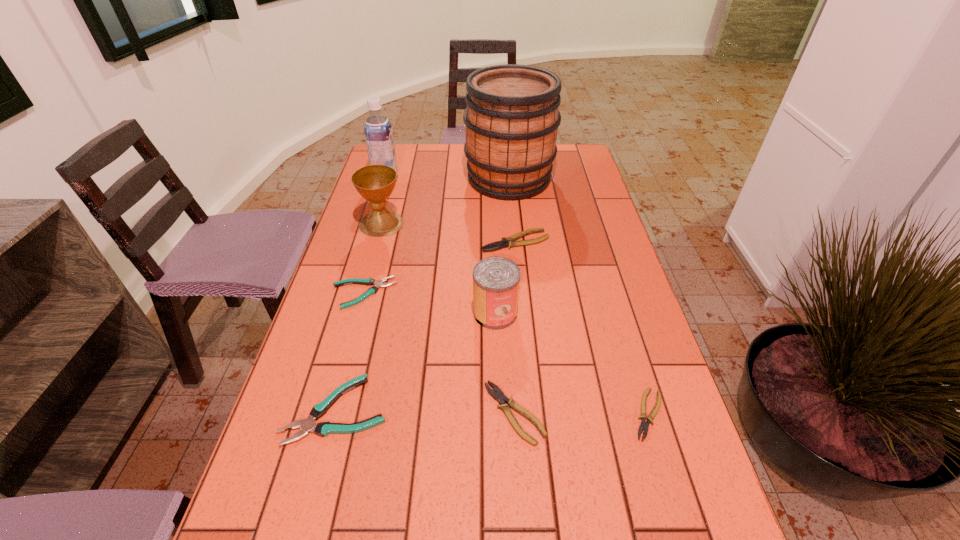
Where is `free spot at the far edge of the desktop`? The width and height of the screenshot is (960, 540). free spot at the far edge of the desktop is located at coordinates (466, 166).

I want to click on vacant space at the left edge of the desktop, so click(x=292, y=443).

In the image, there is a desktop. At what (x,y) coordinates should I click in order to perform the action: click on vacant space at the right edge. Please return your answer as a coordinate pair (x, y). Looking at the image, I should click on (599, 234).

The height and width of the screenshot is (540, 960). Identify the location of vacant space at the far right corner of the desktop. (582, 166).

Where is `free space between the second biggest yellow pliers and the fifth shortest object`? The image size is (960, 540). free space between the second biggest yellow pliers and the fifth shortest object is located at coordinates (515, 327).

Find the location of `empty space that is in between the biggest yellow pliers and the fourth nearest pliers`. empty space that is in between the biggest yellow pliers and the fourth nearest pliers is located at coordinates (440, 267).

Find the location of a particular element. The height and width of the screenshot is (540, 960). free spot between the brown chalice and the nearer teal pliers is located at coordinates (359, 317).

This screenshot has height=540, width=960. I want to click on vacant area that lies between the brown chalice and the tallest pliers, so click(x=448, y=233).

The width and height of the screenshot is (960, 540). I want to click on vacant area between the second biggest yellow pliers and the farther teal pliers, so [439, 353].

Identify the location of vacant space in between the tallest pliers and the bigger teal pliers. The width and height of the screenshot is (960, 540). (426, 326).